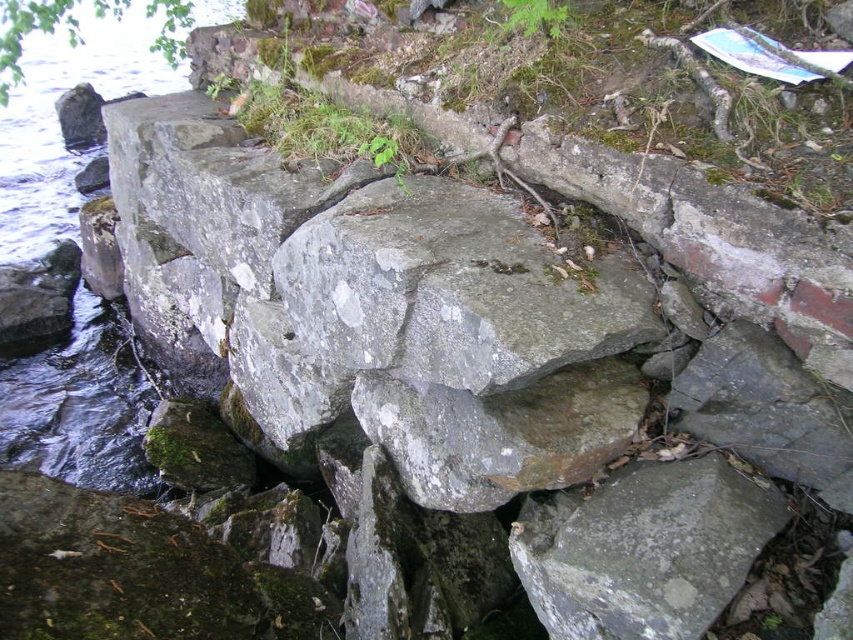
Which is below, gray stone creek at left or gray rough rock at center?

gray rough rock at center

Can you confirm if gray stone creek at left is wider than gray rough rock at center?

Correct, the width of gray stone creek at left exceeds that of gray rough rock at center.

Is point (15, 378) closer to viewer compared to point (496, 497)?

No, it is behind (496, 497).

The height and width of the screenshot is (640, 853). Find the location of `gray stone creek at left`. gray stone creek at left is located at coordinates (59, 129).

Between gray stone creek at left and gray rough stone at center, which one appears on the right side from the viewer's perspective?

Positioned to the right is gray rough stone at center.

Is point (54, 460) farther from camera compared to point (606, 534)?

That is True.

Is point (61, 164) closer to camera compared to point (654, 512)?

No, (61, 164) is behind (654, 512).

Image resolution: width=853 pixels, height=640 pixels. Identify the location of gray stone creek at left. (59, 129).

Is gray rough stone at center thinner than gray rough rock at center?

Indeed, gray rough stone at center has a lesser width compared to gray rough rock at center.

Is gray rough stone at center smaller than gray rough rock at center?

Yes, gray rough stone at center is smaller than gray rough rock at center.

This screenshot has width=853, height=640. In order to click on gray rough stone at center in this screenshot , I will do `click(643, 548)`.